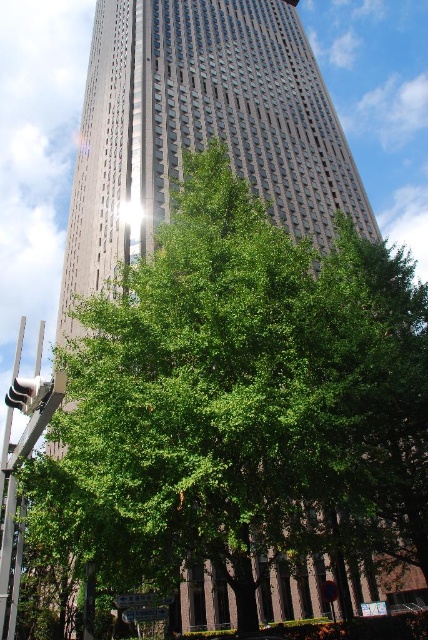
You are standing at the base of the skyscraper and want to find the metallic street sign at center. According to the coordinates given, where should you look relative to your position?

The metallic street sign at center is located at coordinates point (142, 600), which means it is positioned to the right and slightly above your current position.

You are a pedestrian standing at the corner of the street. You see the metallic gray pole at lower left and the green plastic street sign at center. Which object is closer to you?

The metallic gray pole at lower left is closer to you because it is in front of the green plastic street sign at center.

You are a city planner analyzing the urban landscape. You notice two street signs at the center of the image, a metallic street sign at center and a green plastic street sign at center. Which one do you think is larger in size?

The metallic street sign at center is bigger than the green plastic street sign at center, so the metallic one is larger in size.